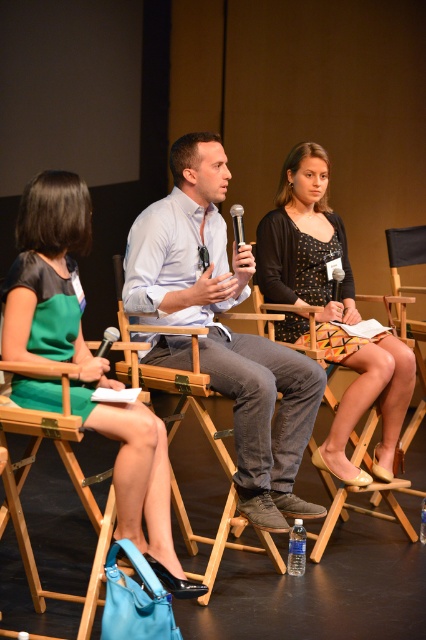
Question: Can you confirm if matte black microphone at center is positioned to the left of black plastic microphone at center?

Choices:
 (A) yes
 (B) no

Answer: (A)

Question: Where is light blue shirt at center located in relation to matte black microphone at center in the image?

Choices:
 (A) below
 (B) above

Answer: (B)

Question: Among these objects, which one is nearest to the camera?

Choices:
 (A) polka dot dress at center
 (B) light blue shirt at center

Answer: (B)

Question: Estimate the real-world distances between objects in this image. Which object is farther from the black plastic microphone at center?

Choices:
 (A) metallic silver microphone at center
 (B) green satin dress at center
 (C) polka dot dress at center
 (D) matte black microphone at center

Answer: (B)

Question: Which point is farther to the camera?

Choices:
 (A) light blue shirt at center
 (B) matte black microphone at center
 (C) metallic silver microphone at center
 (D) polka dot dress at center

Answer: (D)

Question: Is matte black microphone at center to the right of black plastic microphone at center from the viewer's perspective?

Choices:
 (A) yes
 (B) no

Answer: (B)